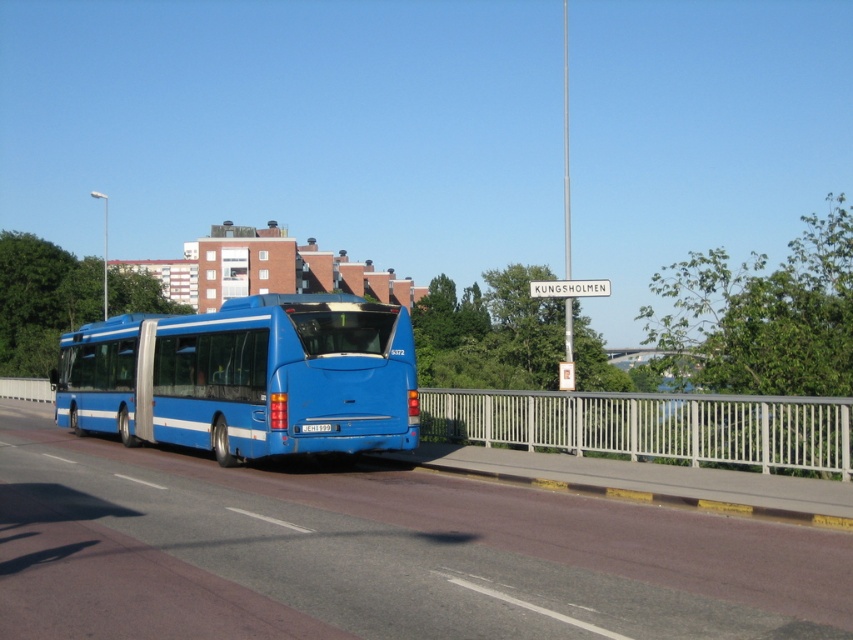
Question: Which of these objects is positioned closest to the blue metallic bus at center?

Choices:
 (A) metallic gray rail at center
 (B) white plastic street sign at upper center
 (C) blue rubber highway at center

Answer: (C)

Question: Can you confirm if blue rubber highway at center is positioned to the right of blue metallic bus at center?

Choices:
 (A) no
 (B) yes

Answer: (B)

Question: Does blue rubber highway at center have a lesser width compared to blue metallic bus at center?

Choices:
 (A) no
 (B) yes

Answer: (A)

Question: Which point is closer to the camera?

Choices:
 (A) blue rubber highway at center
 (B) white plastic street sign at upper center
 (C) blue metallic bus at center

Answer: (A)

Question: Among these objects, which one is nearest to the camera?

Choices:
 (A) metallic gray rail at center
 (B) blue metallic bus at center
 (C) white plastic street sign at upper center
 (D) blue rubber highway at center

Answer: (D)

Question: Can you confirm if blue rubber highway at center is positioned below white plastic street sign at upper center?

Choices:
 (A) no
 (B) yes

Answer: (B)